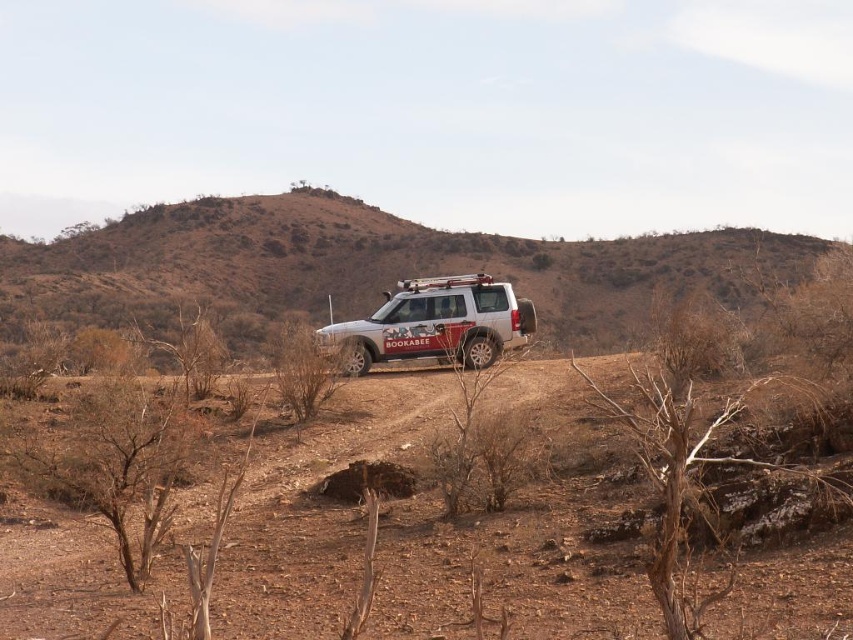
Question: Can you confirm if brown dry soil at center is smaller than white matte jeep at center?

Choices:
 (A) no
 (B) yes

Answer: (A)

Question: Which point is farther to the camera?

Choices:
 (A) (49, 291)
 (B) (305, 554)

Answer: (A)

Question: Considering the relative positions of brown dry soil at center and white matte jeep at center in the image provided, where is brown dry soil at center located with respect to white matte jeep at center?

Choices:
 (A) right
 (B) left

Answer: (A)

Question: Estimate the real-world distances between objects in this image. Which object is farther from the brown dry soil at center?

Choices:
 (A) brown dirt hillside at center
 (B) white matte jeep at center

Answer: (A)

Question: Based on their relative distances, which object is nearer to the brown dry soil at center?

Choices:
 (A) brown dirt hillside at center
 (B) white matte jeep at center

Answer: (B)

Question: Is brown dry soil at center in front of white matte jeep at center?

Choices:
 (A) yes
 (B) no

Answer: (A)